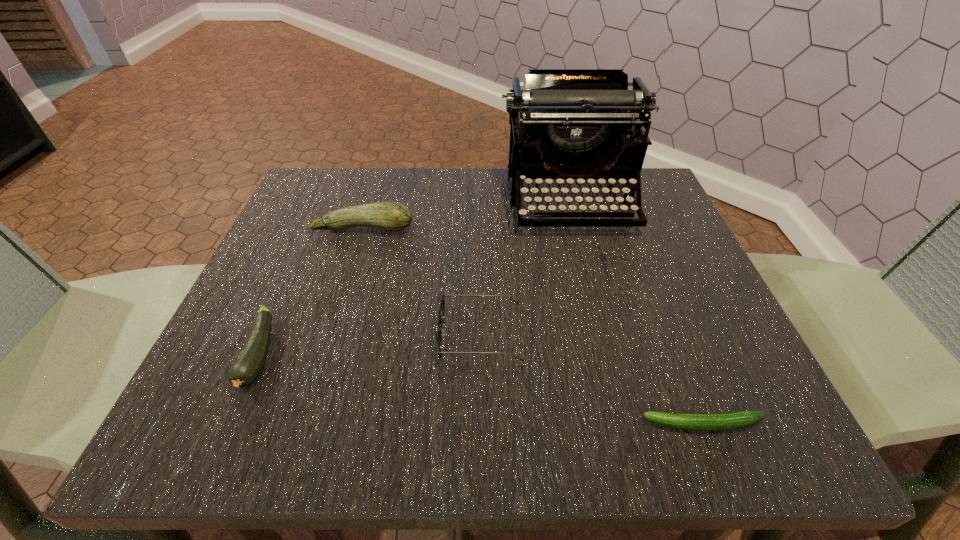
At what (x,y) coordinates should I click in order to perform the action: click on object positioned at the near left corner. Please return your answer as a coordinate pair (x, y). Image resolution: width=960 pixels, height=540 pixels. Looking at the image, I should click on (246, 367).

In order to click on object situated at the far right corner in this screenshot , I will do `click(580, 124)`.

Where is `object present at the near right corner`? This screenshot has width=960, height=540. object present at the near right corner is located at coordinates (729, 421).

I want to click on free region at the far edge of the desktop, so click(x=501, y=173).

Where is `free space at the near edge of the desktop`? Image resolution: width=960 pixels, height=540 pixels. free space at the near edge of the desktop is located at coordinates (375, 416).

In the image, there is a desktop. Identify the location of vacant space at the left edge. Image resolution: width=960 pixels, height=540 pixels. (299, 228).

Where is `vacant region at the right edge of the desktop`? This screenshot has height=540, width=960. vacant region at the right edge of the desktop is located at coordinates (648, 321).

Where is `free space at the far left corner`? The image size is (960, 540). free space at the far left corner is located at coordinates (324, 204).

Where is `free region at the near right corner`? free region at the near right corner is located at coordinates (675, 400).

The width and height of the screenshot is (960, 540). What are the coordinates of `free space between the tallest zucchini and the nearest zucchini` in the screenshot? It's located at 533,326.